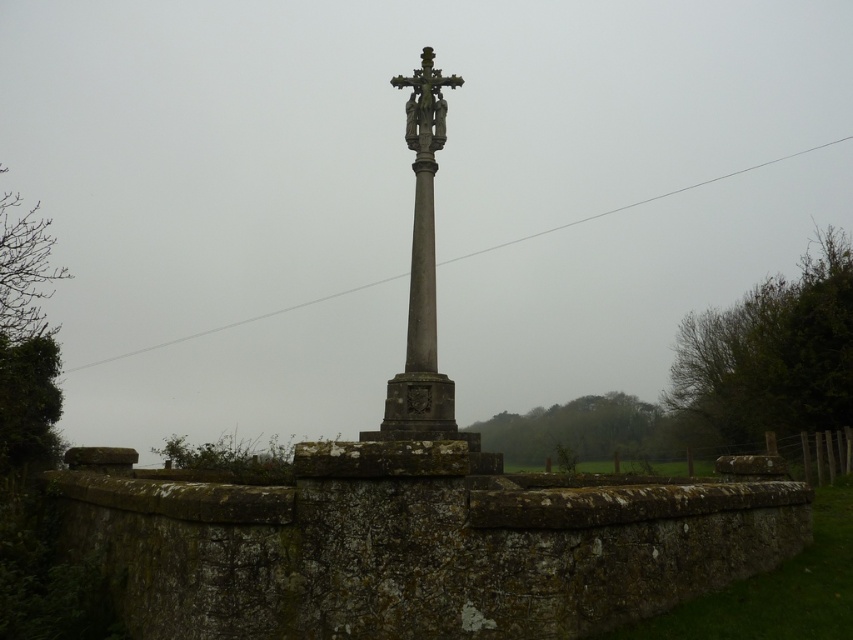
You are standing at the origin point in the image. The gray stone cross at center is at coordinates approximately 0.434 on the x and 0.496 on the y. If you want to walk directly towards the cross, which direction should you move?

To walk directly towards the gray stone cross at center located at coordinates approximately 0.434 on the x and 0.496 on the y, you should move northeast since the cross is positioned northeast of the origin point.

You are a tourist visiting a historic site and want to take a photo of the gray stone cross at center and the dark gray stone crucifix at center. Which one should you focus on to capture the most detailed image?

The gray stone cross at center is larger in size than the dark gray stone crucifix at center, so focusing on the gray stone cross at center will allow you to capture more detailed features in your photo.